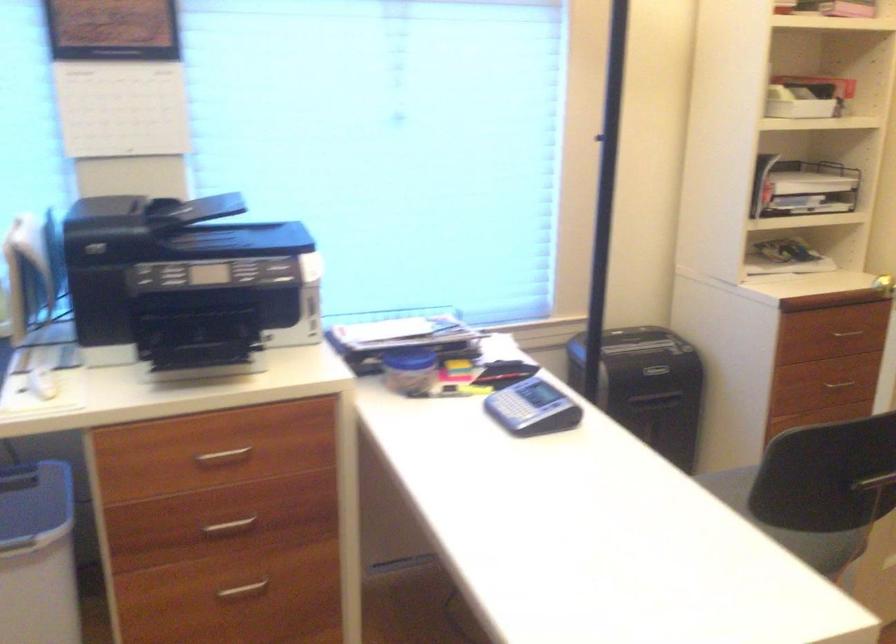
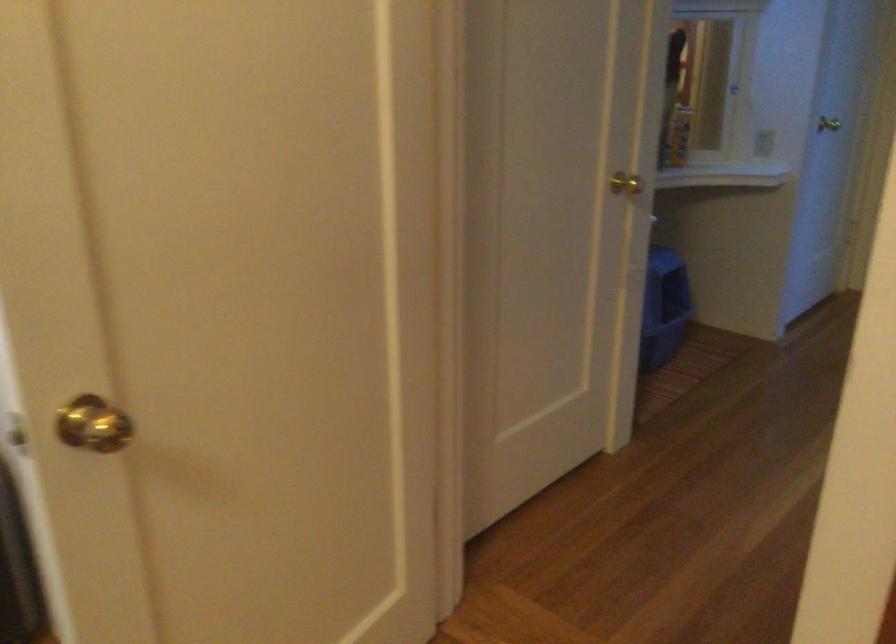
Question: I am providing you with two images of the same scene from different viewpoints. After the viewpoint changes to image2, which objects are now occluded?

Choices:
 (A) brass doorknob
 (B) light switch
 (C) drawer handle
 (D) gold door pull

Answer: (C)